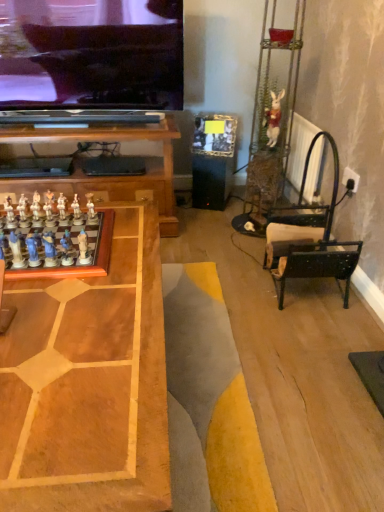
Locate an element on the screen. empty space that is ontop of wooden chessboard at center is located at coordinates (74, 317).